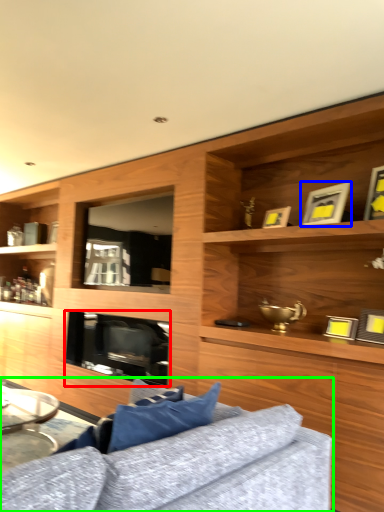
Question: Which is nearer to the fireplace (highlighted by a red box)? picture frame (highlighted by a blue box) or studio couch (highlighted by a green box).

Choices:
 (A) picture frame
 (B) studio couch

Answer: (A)